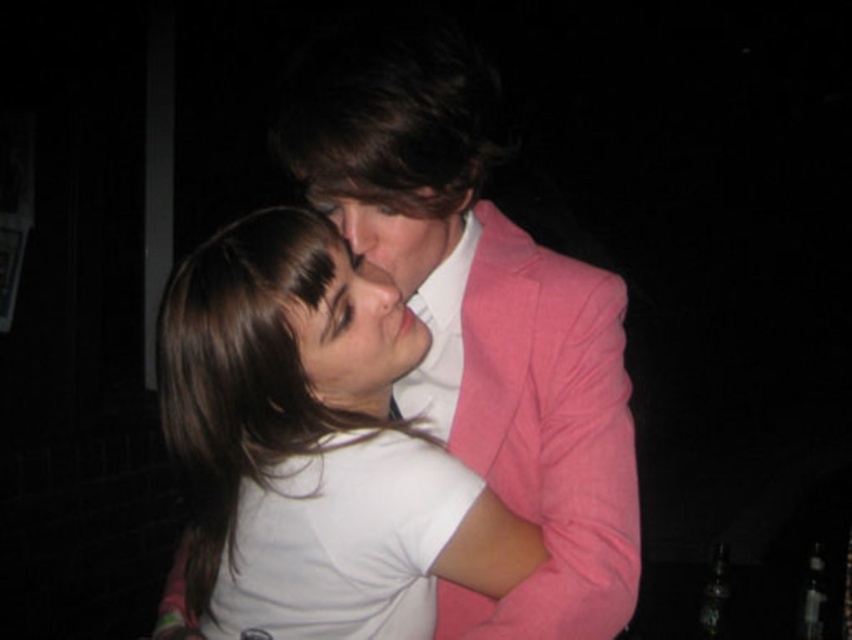
Question: Based on their relative distances, which object is farther from the white matte shirt at center?

Choices:
 (A) matte pink blazer at center
 (B) matte white face at center
 (C) pink fabric jacket at center

Answer: (A)

Question: Can you confirm if pink fabric jacket at center is thinner than matte pink blazer at center?

Choices:
 (A) no
 (B) yes

Answer: (A)

Question: Which is nearer to the matte white face at center?

Choices:
 (A) matte pink blazer at center
 (B) pink fabric jacket at center
 (C) white matte shirt at center

Answer: (A)

Question: Is pink fabric jacket at center above white matte shirt at center?

Choices:
 (A) no
 (B) yes

Answer: (B)

Question: Considering the relative positions of white matte shirt at center and matte pink blazer at center in the image provided, where is white matte shirt at center located with respect to matte pink blazer at center?

Choices:
 (A) above
 (B) below

Answer: (B)

Question: Which object is farther from the camera taking this photo?

Choices:
 (A) white matte shirt at center
 (B) pink fabric jacket at center

Answer: (A)